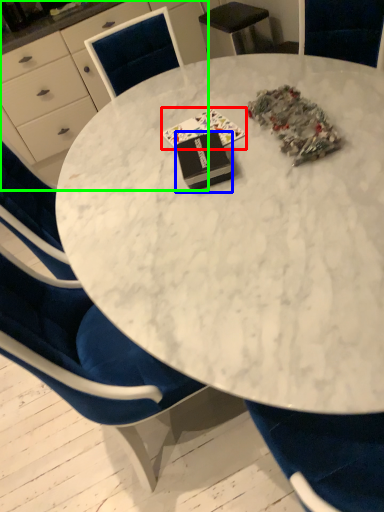
Question: Which is farther away from book (highlighted by a red box)? book (highlighted by a blue box) or desk (highlighted by a green box)?

Choices:
 (A) book
 (B) desk

Answer: (B)